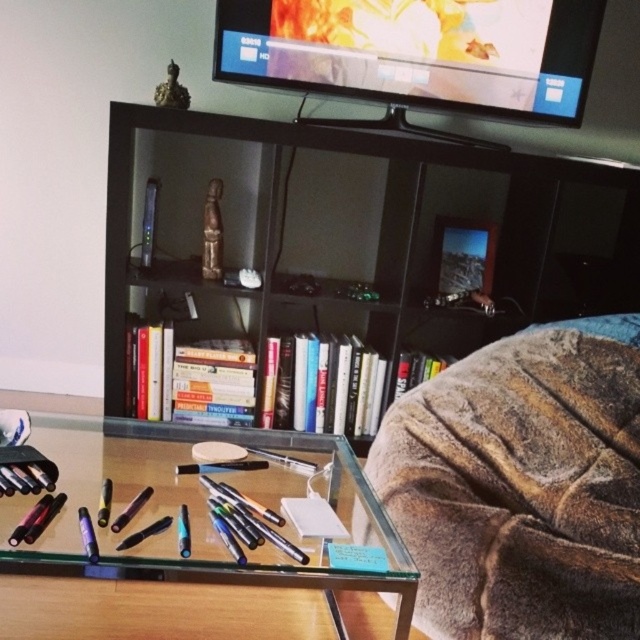
Question: Is fuzzy brown couch at lower right wider than flat screen tv at upper center?

Choices:
 (A) yes
 (B) no

Answer: (B)

Question: Among these points, which one is farthest from the camera?

Choices:
 (A) (564, 564)
 (B) (356, 586)
 (C) (387, 157)
 (D) (320, 76)

Answer: (C)

Question: Can you confirm if fuzzy brown couch at lower right is positioned to the right of transparent glass table at center?

Choices:
 (A) yes
 (B) no

Answer: (A)

Question: Observing the image, what is the correct spatial positioning of black matte bookshelf at center in reference to fuzzy brown couch at lower right?

Choices:
 (A) right
 (B) left

Answer: (B)

Question: Which object is the closest to the black matte bookshelf at center?

Choices:
 (A) fuzzy brown couch at lower right
 (B) transparent glass table at center

Answer: (A)

Question: Among these objects, which one is farthest from the camera?

Choices:
 (A) black matte bookshelf at center
 (B) transparent glass table at center
 (C) fuzzy brown couch at lower right

Answer: (A)